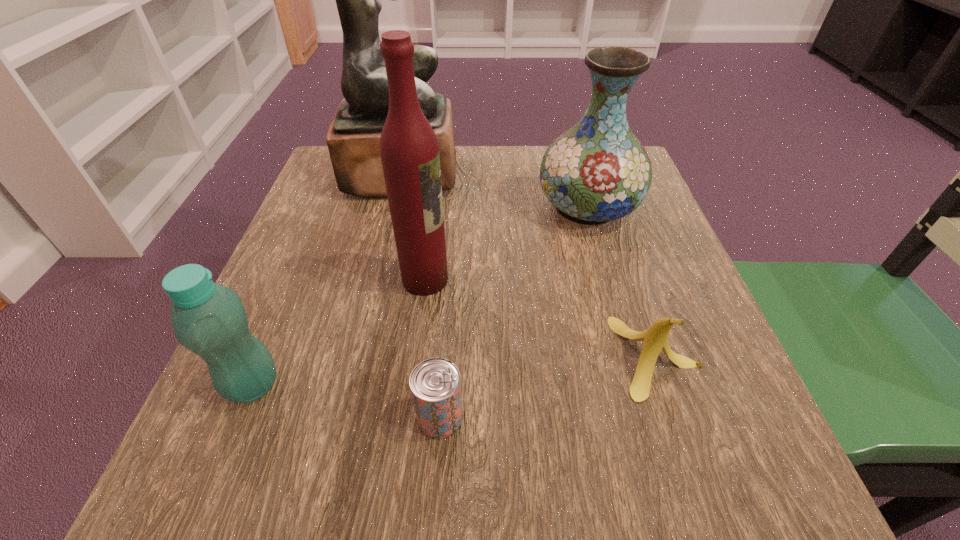
This screenshot has height=540, width=960. I want to click on object at the far left corner, so click(353, 139).

Where is `object at the far right corner`? The width and height of the screenshot is (960, 540). object at the far right corner is located at coordinates (597, 171).

The width and height of the screenshot is (960, 540). In the image, there is a desktop. Find the location of `vacant area at the far edge`. vacant area at the far edge is located at coordinates (521, 177).

In the image, there is a desktop. Identify the location of vacant space at the left edge. (298, 276).

I want to click on vacant space at the right edge of the desktop, so click(x=681, y=263).

Locate an element on the screen. This screenshot has height=540, width=960. vacant space at the near left corner of the desktop is located at coordinates (192, 461).

This screenshot has height=540, width=960. Find the location of `free space between the fourth shortest object and the beer can`. free space between the fourth shortest object and the beer can is located at coordinates (514, 313).

Identify the location of vacant space that is in between the shortest object and the third farthest object. The height and width of the screenshot is (540, 960). (433, 348).

Identify the location of vacant space that's between the fourth nearest object and the water bottle. (339, 332).

This screenshot has width=960, height=540. I want to click on unoccupied area between the water bottle and the second tallest object, so click(x=339, y=332).